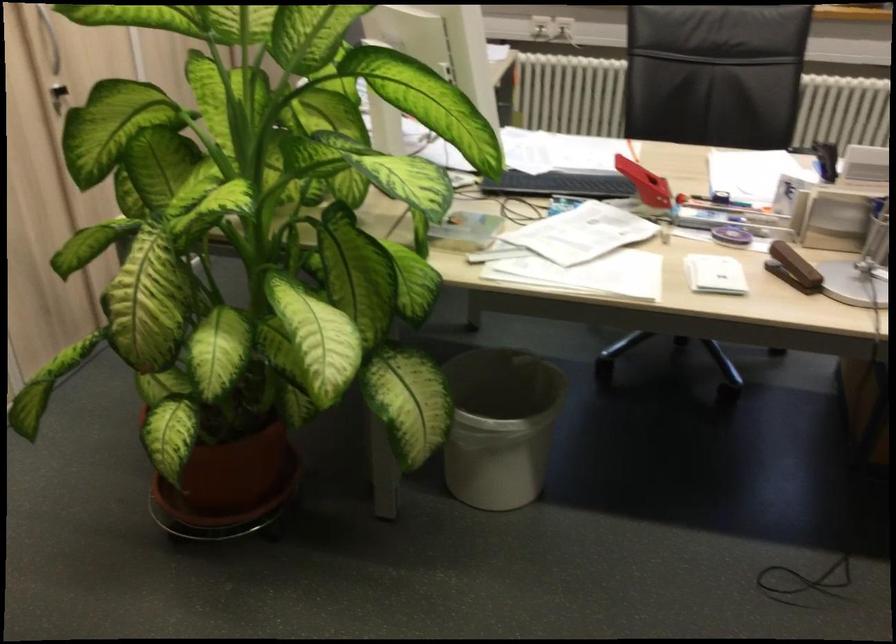
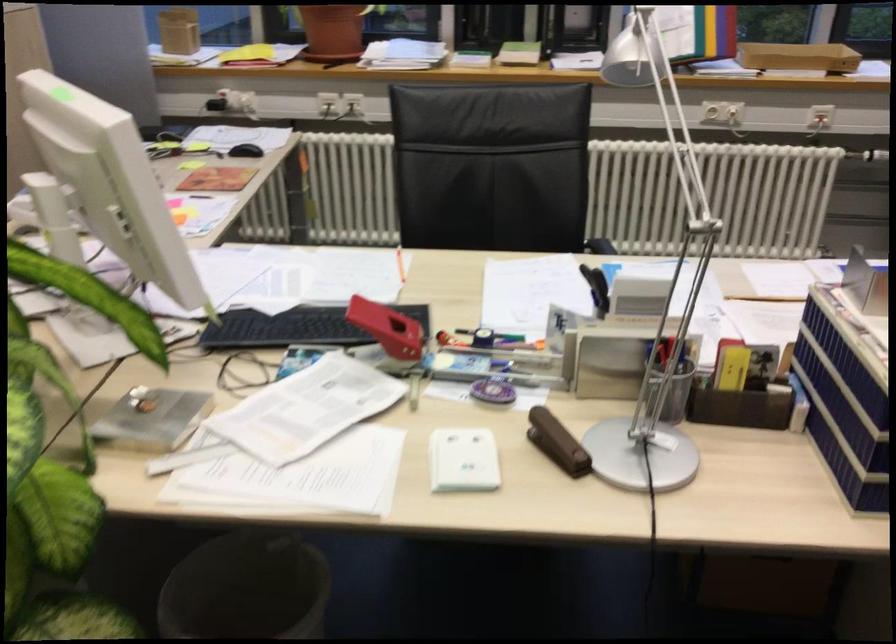
Find the pixel in the second image that matches [712,274] in the first image.

(462, 460)